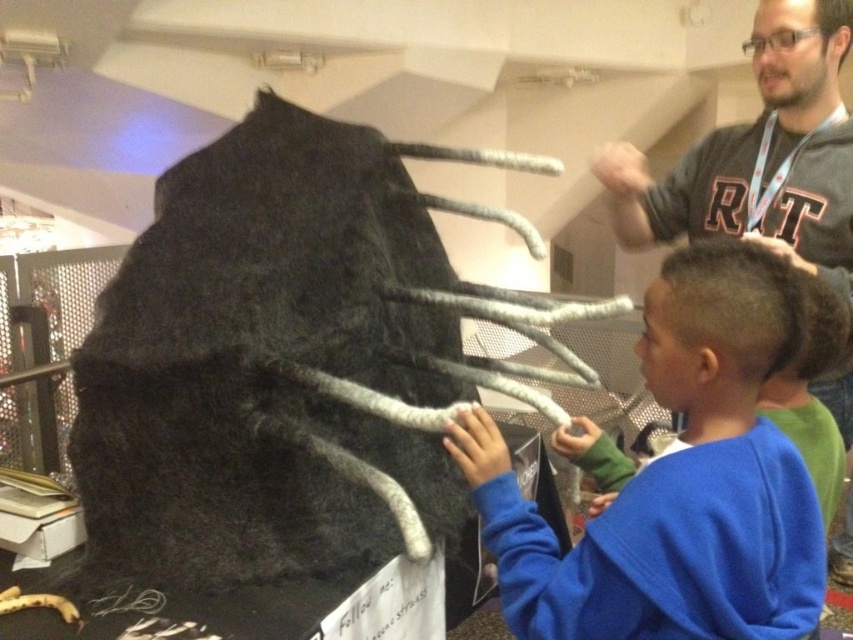
Question: Is the position of blue fleece sweater at center less distant than that of dark gray sweater at upper right?

Choices:
 (A) no
 (B) yes

Answer: (B)

Question: Which object is closer to the camera taking this photo?

Choices:
 (A) blue fleece sweater at center
 (B) dark gray sweater at upper right

Answer: (A)

Question: Does blue fleece sweater at center come in front of dark gray sweater at upper right?

Choices:
 (A) yes
 (B) no

Answer: (A)

Question: Which of the following is the farthest from the observer?

Choices:
 (A) blue fleece sweater at center
 (B) dark gray sweater at upper right

Answer: (B)

Question: Can you confirm if blue fleece sweater at center is positioned to the right of dark gray sweater at upper right?

Choices:
 (A) no
 (B) yes

Answer: (A)